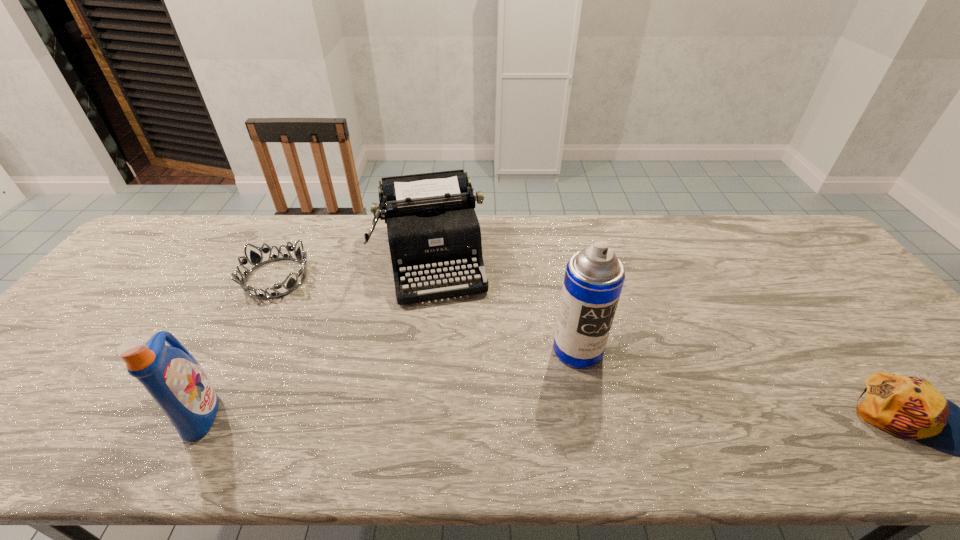
Where is `free space located on the front-facing side of the shortest object`? The image size is (960, 540). free space located on the front-facing side of the shortest object is located at coordinates (373, 347).

Locate an element on the screen. This screenshot has height=540, width=960. free space located 0.050m on the front-facing side of the shortest object is located at coordinates (307, 300).

This screenshot has width=960, height=540. I want to click on vacant region located 0.220m on the front-facing side of the shortest object, so click(348, 328).

I want to click on blank space located 0.070m on the label side of the aerosol can, so click(617, 388).

Locate an element on the screen. Image resolution: width=960 pixels, height=540 pixels. vacant space situated 0.120m on the label side of the aerosol can is located at coordinates pos(634,403).

Locate an element on the screen. Image resolution: width=960 pixels, height=540 pixels. blank area located 0.140m on the label side of the aerosol can is located at coordinates (640, 410).

At what (x,y) coordinates should I click in order to perform the action: click on typewriter situated at the far edge. Please return your answer as a coordinate pair (x, y). This screenshot has height=540, width=960. Looking at the image, I should click on (433, 231).

In order to click on tiara that is at the far edge in this screenshot , I will do `click(256, 260)`.

What are the coordinates of `object that is at the near edge` in the screenshot? It's located at (172, 376).

Where is `free space at the far edge`? This screenshot has height=540, width=960. free space at the far edge is located at coordinates (492, 249).